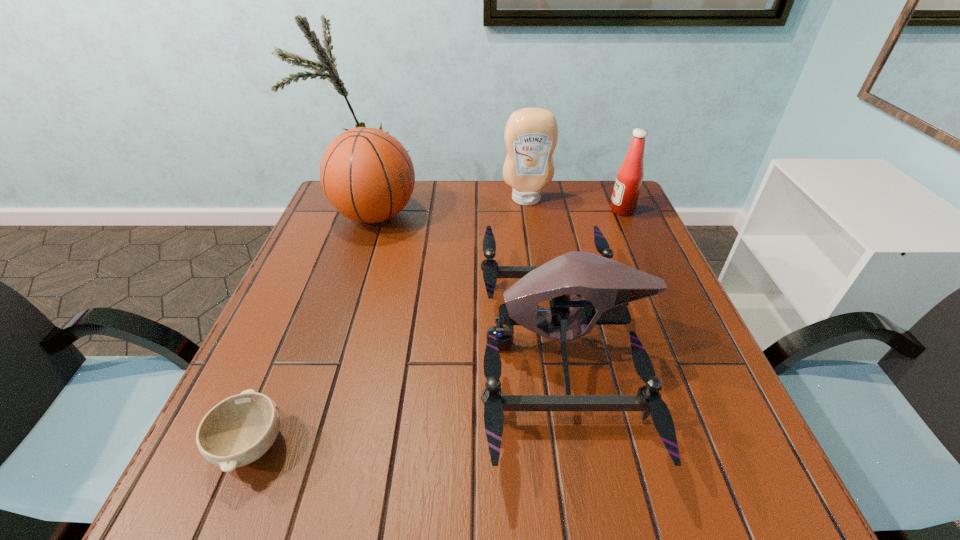
Where is `the closest object relative to the bowl`? This screenshot has height=540, width=960. the closest object relative to the bowl is located at coordinates (608, 286).